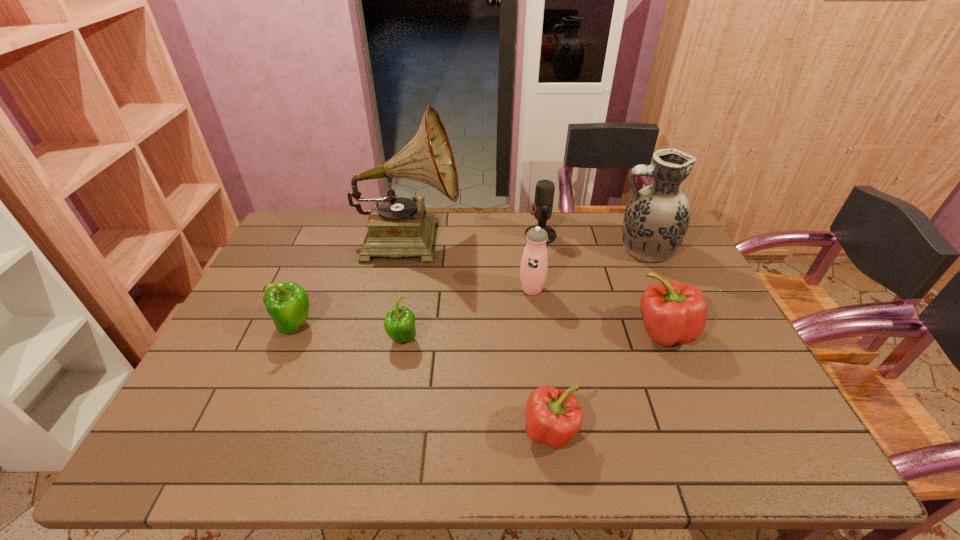
In order to click on free space between the red microphone and the record player in this screenshot , I will do `click(474, 237)`.

I want to click on unoccupied position between the nearest bell pepper and the leftmost object, so click(422, 379).

In order to click on free spot between the red microphone and the second tallest object in this screenshot , I will do `click(592, 242)`.

You are a GUI agent. You are given a task and a screenshot of the screen. Output one action in this format:
    pyautogui.click(x=<x>, y=<y>)
    Task: Click on the free area in between the red microphone and the second bell pepper from left to right
    This screenshot has width=960, height=540.
    Given the screenshot: What is the action you would take?
    pyautogui.click(x=471, y=287)

This screenshot has width=960, height=540. I want to click on free area in between the microphone and the tallest object, so click(x=474, y=237).

Where is `object that is the fourth closest to the second bell pepper from left to right`? The image size is (960, 540). object that is the fourth closest to the second bell pepper from left to right is located at coordinates (x=553, y=416).

At what (x,y) coordinates should I click in order to perform the action: click on the fourth closest object to the right green bell pepper. Please return your answer as a coordinate pair (x, y). The image size is (960, 540). Looking at the image, I should click on click(553, 416).

The image size is (960, 540). Identify the location of bell pepper that is the second closest to the right pink bell pepper. (399, 324).

Locate an element on the screen. This screenshot has height=540, width=960. bell pepper that can be found as the third closest to the blue vase is located at coordinates (399, 324).

In order to click on vacant space that satisfies the following two spatial constraints: 1. with the handle on the side of the vase; 2. from the horn of the tallest object in this screenshot , I will do `click(639, 238)`.